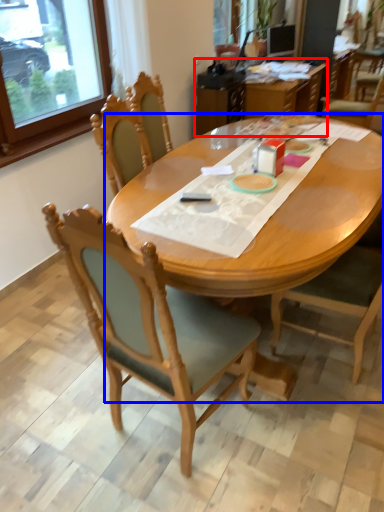
Question: Among these objects, which one is farthest to the camera, table (highlighted by a red box) or desk (highlighted by a blue box)?

Choices:
 (A) table
 (B) desk

Answer: (A)